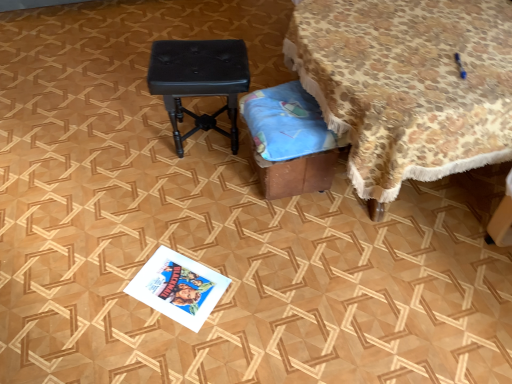
Question: Is floral fabric-covered table at upper right wider or thinner than black leather stool at center?

Choices:
 (A) thin
 (B) wide

Answer: (B)

Question: Choose the correct answer: Is floral fabric-covered table at upper right inside black leather stool at center or outside it?

Choices:
 (A) inside
 (B) outside

Answer: (B)

Question: Which of these objects is positioned farthest from the black leather stool at center?

Choices:
 (A) brown cardboard box at lower center
 (B) floral fabric-covered table at upper right
 (C) white glossy magazine at lower center

Answer: (C)

Question: Which object is the farthest from the brown cardboard box at lower center?

Choices:
 (A) floral fabric-covered table at upper right
 (B) white glossy magazine at lower center
 (C) black leather stool at center

Answer: (B)